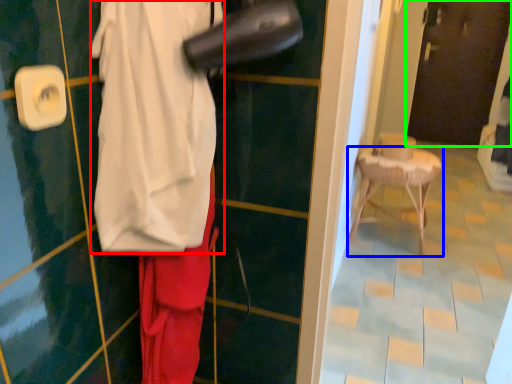
Question: Which is nearer to the wide (highlighted by a red box)? furniture (highlighted by a blue box) or door (highlighted by a green box).

Choices:
 (A) furniture
 (B) door

Answer: (A)